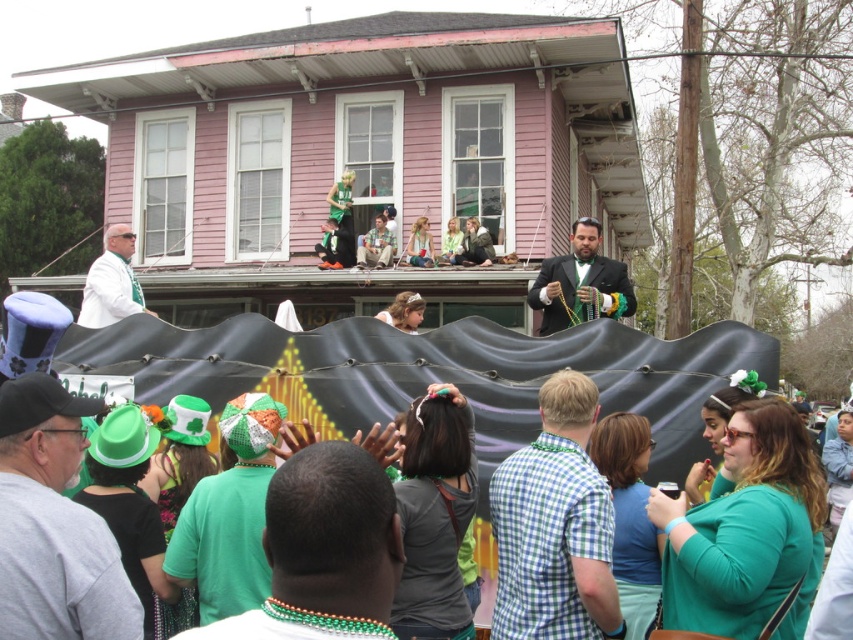
Based on the photo, what are the coordinates of the green felt hat at lower left in the image?

The green felt hat at lower left is located at coordinates point (54, 524).

You are an event planner observing the festive parade scene. You notice the green matte shirt at lower center and the green fabric at upper center. Which object is shorter in height?

The green matte shirt at lower center is not as tall as the green fabric at upper center, so the green matte shirt at lower center is shorter in height.

You are standing at the center of the image and looking towards the house. Which direction should you move to reach the green matte shirt at lower center located at point (323, 550)?

Since the green matte shirt at lower center is located at point (323, 550), you should move downward and to the right to reach it from the center of the image.